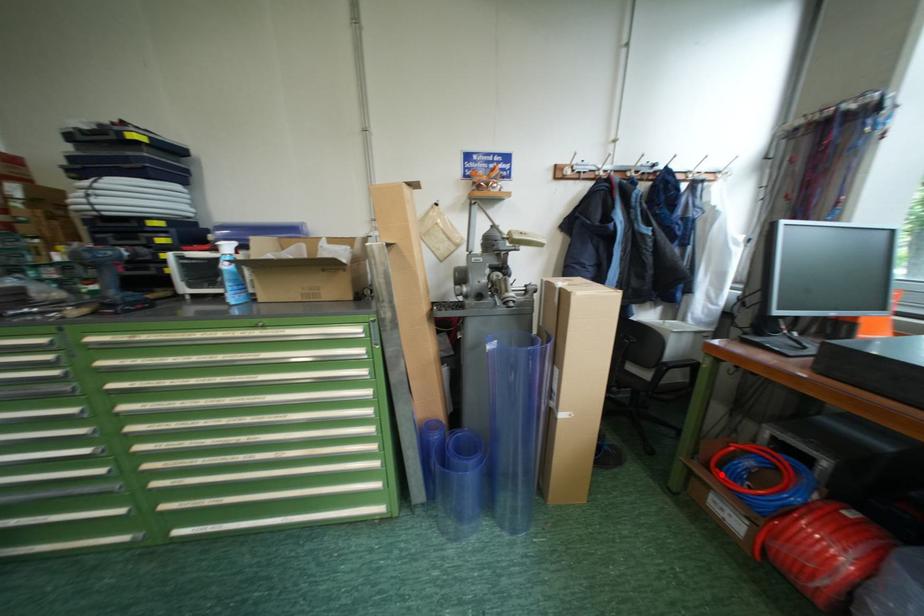
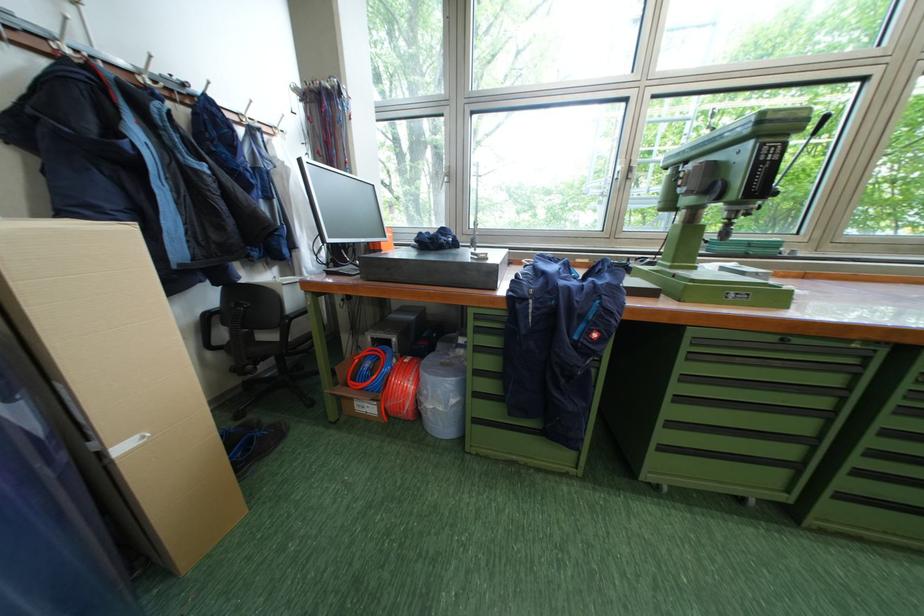
Find the pixel in the second image that matches the highlighted location in the first image.

(359, 389)